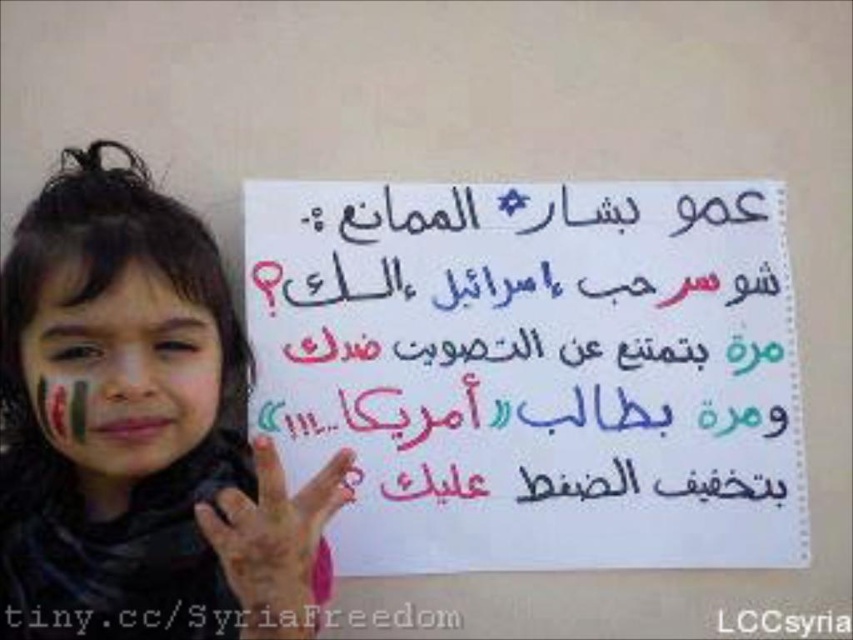
Is white paper at center shorter than pink matte hand at center?

Incorrect, white paper at center's height does not fall short of pink matte hand at center's.

Who is positioned more to the right, white paper at center or pink matte hand at center?

white paper at center is more to the right.

Which is behind, point (573, 208) or point (309, 625)?

The point (573, 208) is behind.

You are a GUI agent. You are given a task and a screenshot of the screen. Output one action in this format:
    pyautogui.click(x=<x>, y=<y>)
    Task: Click on the white paper at center
    The width and height of the screenshot is (853, 640).
    Given the screenshot: What is the action you would take?
    pyautogui.click(x=532, y=369)

Does matte plastic face at center come behind pink matte hand at center?

Yes, matte plastic face at center is further from the viewer.

Where is `matte plastic face at center`? This screenshot has height=640, width=853. matte plastic face at center is located at coordinates (120, 371).

Can you confirm if matte black scarf at center is shorter than matte plastic face at center?

In fact, matte black scarf at center may be taller than matte plastic face at center.

Who is more distant from viewer, (318,500) or (106,349)?

The point (106,349) is behind.

Identify the location of matte black scarf at center. Image resolution: width=853 pixels, height=640 pixels. (138, 429).